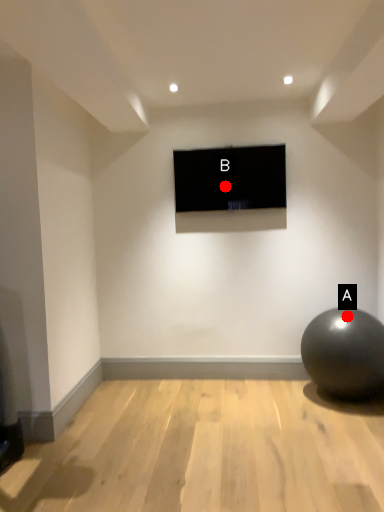
Question: Two points are circled on the image, labeled by A and B beside each circle. Which point appears closest to the camera in this image?

Choices:
 (A) A is closer
 (B) B is closer

Answer: (A)